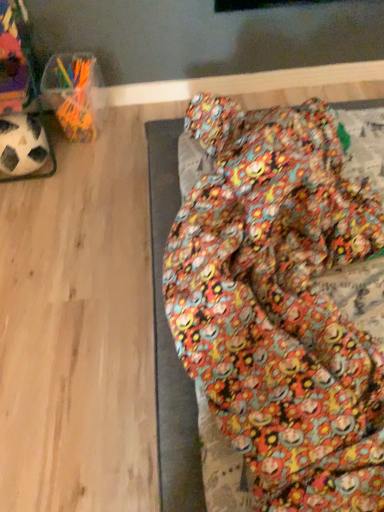
Image resolution: width=384 pixels, height=512 pixels. I want to click on free point to the right of black matte soccer ball at left, so click(86, 167).